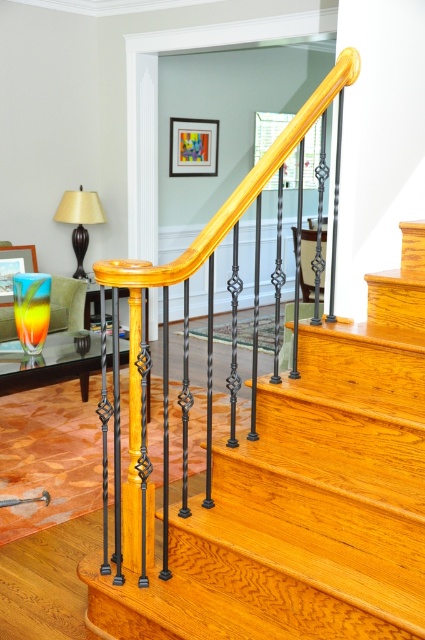
Question: Which point is closer to the camera?

Choices:
 (A) matte wood stairs at center
 (B) matte black lampshade at left

Answer: (A)

Question: Is matte wood stairs at center smaller than matte black lampshade at left?

Choices:
 (A) no
 (B) yes

Answer: (A)

Question: Is matte wood stairs at center smaller than matte black lampshade at left?

Choices:
 (A) yes
 (B) no

Answer: (B)

Question: Which point is farther to the camera?

Choices:
 (A) matte black lampshade at left
 (B) matte wood stairs at center

Answer: (A)

Question: Is matte wood stairs at center above matte black lampshade at left?

Choices:
 (A) yes
 (B) no

Answer: (B)

Question: Which point is farther to the camera?

Choices:
 (A) (61, 220)
 (B) (326, 467)

Answer: (A)